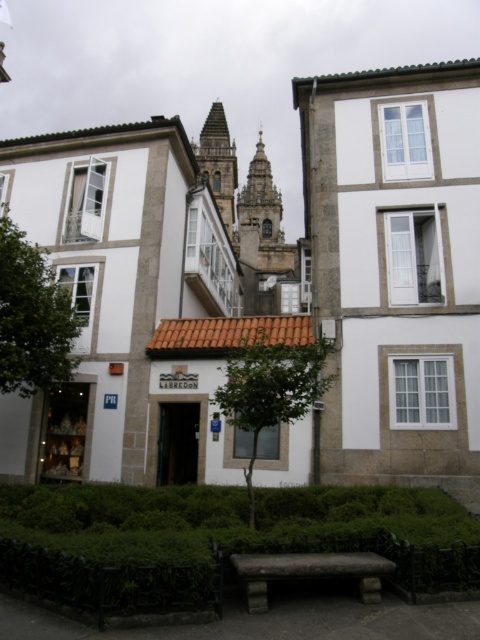
Is point (43, 369) positioned in front of point (259, 132)?

That is True.

Image resolution: width=480 pixels, height=640 pixels. Identify the location of green leafy tree at left. (32, 316).

Is point (24, 266) less distant than point (244, 592)?

No.

In the scene shown: Who is positioned more to the left, green leafy tree at left or stone textured bench at center?

Positioned to the left is green leafy tree at left.

Consider the image. Who is more forward, [41,284] or [240,577]?

Point [240,577] is in front.

What are the coordinates of `green leafy tree at left` in the screenshot? It's located at (32, 316).

Which of these two, green leafy tree at center or brown stone bell tower at upper center, stands taller?

Standing taller between the two is brown stone bell tower at upper center.

Does green leafy tree at center have a lesser width compared to brown stone bell tower at upper center?

Indeed, green leafy tree at center has a lesser width compared to brown stone bell tower at upper center.

Does point (277, 342) lie in front of point (212, 134)?

Yes.

You are a GUI agent. You are given a task and a screenshot of the screen. Output one action in this format:
    pyautogui.click(x=<x>, y=<y>)
    Task: Click on the green leafy tree at center
    
    Given the screenshot: What is the action you would take?
    [x=269, y=388]